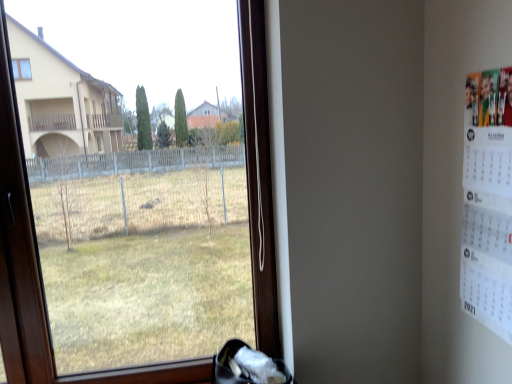
Question: Considering the relative sizes of white paper calendar at right and transparent glass window at center in the image provided, is white paper calendar at right taller than transparent glass window at center?

Choices:
 (A) yes
 (B) no

Answer: (B)

Question: Is white paper calendar at right facing towards transparent glass window at center?

Choices:
 (A) no
 (B) yes

Answer: (A)

Question: Are white paper calendar at right and transparent glass window at center beside each other?

Choices:
 (A) no
 (B) yes

Answer: (A)

Question: Would you say white paper calendar at right is a long distance from transparent glass window at center?

Choices:
 (A) no
 (B) yes

Answer: (B)

Question: Is transparent glass window at center completely or partially inside white paper calendar at right?

Choices:
 (A) no
 (B) yes

Answer: (A)

Question: Does white paper calendar at right have a smaller size compared to transparent glass window at center?

Choices:
 (A) no
 (B) yes

Answer: (B)

Question: Is transparent glass window at center closer to the viewer compared to white paper calendar at right?

Choices:
 (A) no
 (B) yes

Answer: (A)

Question: Is transparent glass window at center oriented away from white paper calendar at right?

Choices:
 (A) yes
 (B) no

Answer: (B)

Question: Can you confirm if transparent glass window at center is bigger than white paper calendar at right?

Choices:
 (A) yes
 (B) no

Answer: (A)

Question: From the image's perspective, does transparent glass window at center appear lower than white paper calendar at right?

Choices:
 (A) no
 (B) yes

Answer: (B)

Question: From the image's perspective, is transparent glass window at center over white paper calendar at right?

Choices:
 (A) yes
 (B) no

Answer: (B)

Question: Could you tell me if transparent glass window at center is facing white paper calendar at right?

Choices:
 (A) yes
 (B) no

Answer: (B)

Question: Considering the relative positions of white fabric shoe at lower center and white paper calendar at right in the image provided, is white fabric shoe at lower center to the left of white paper calendar at right from the viewer's perspective?

Choices:
 (A) yes
 (B) no

Answer: (A)